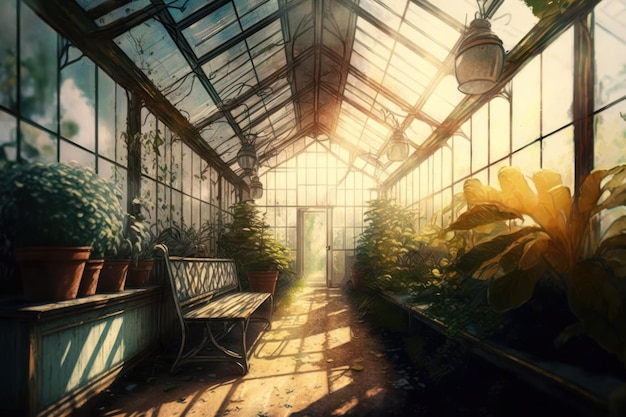
This screenshot has width=626, height=417. In order to click on hanging lanterns on ceiling in this screenshot , I will do `click(248, 165)`, `click(254, 193)`, `click(488, 76)`, `click(389, 149)`.